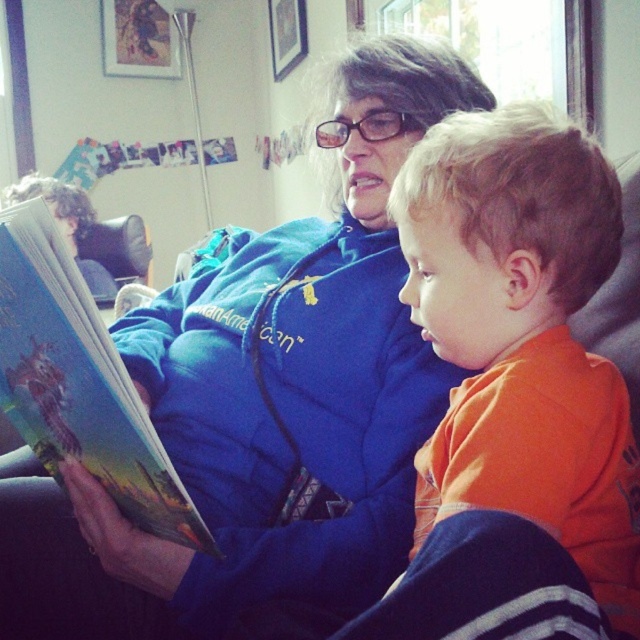
Between point (504, 452) and point (77, 380), which one is positioned behind?

The point (77, 380) is behind.

Is orange cotton shirt at center bigger than hardcover book at left?

Actually, orange cotton shirt at center might be smaller than hardcover book at left.

Describe the element at coordinates (522, 337) in the screenshot. I see `orange cotton shirt at center` at that location.

Where is `orange cotton shirt at center`? The width and height of the screenshot is (640, 640). orange cotton shirt at center is located at coordinates (522, 337).

Does blue fleece jacket at center appear under hardcover book at left?

Incorrect, blue fleece jacket at center is not positioned below hardcover book at left.

The height and width of the screenshot is (640, 640). What do you see at coordinates (266, 410) in the screenshot?
I see `blue fleece jacket at center` at bounding box center [266, 410].

Between point (364, 515) and point (166, 532), which one is positioned in front?

Point (166, 532) is in front.

What are the coordinates of `blue fleece jacket at center` in the screenshot? It's located at (266, 410).

Can you confirm if blue fleece jacket at center is positioned to the right of orange cotton shirt at center?

In fact, blue fleece jacket at center is to the left of orange cotton shirt at center.

Is blue fleece jacket at center in front of orange cotton shirt at center?

No.

Is point (227, 522) positioned after point (474, 285)?

Yes.

Locate an element on the screen. blue fleece jacket at center is located at coordinates (266, 410).